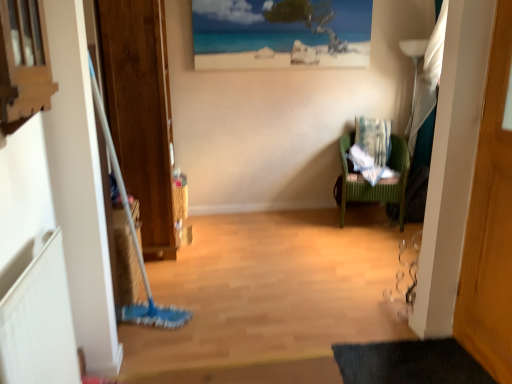
At what (x,y) coordinates should I click in order to perform the action: click on free location above black rubber bath mat at lower right (from a real-world perspective). Please return your answer as a coordinate pair (x, y). The height and width of the screenshot is (384, 512). Looking at the image, I should click on (401, 358).